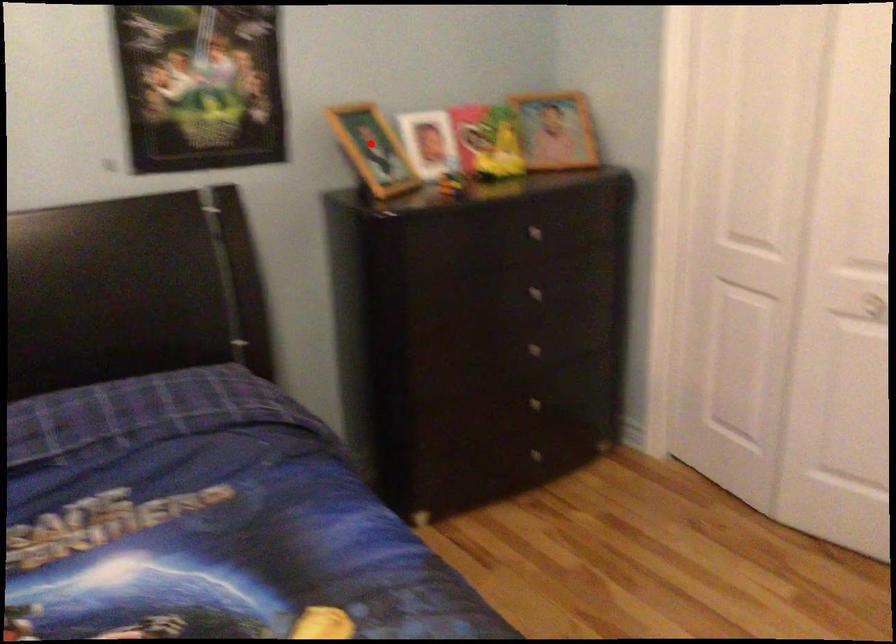
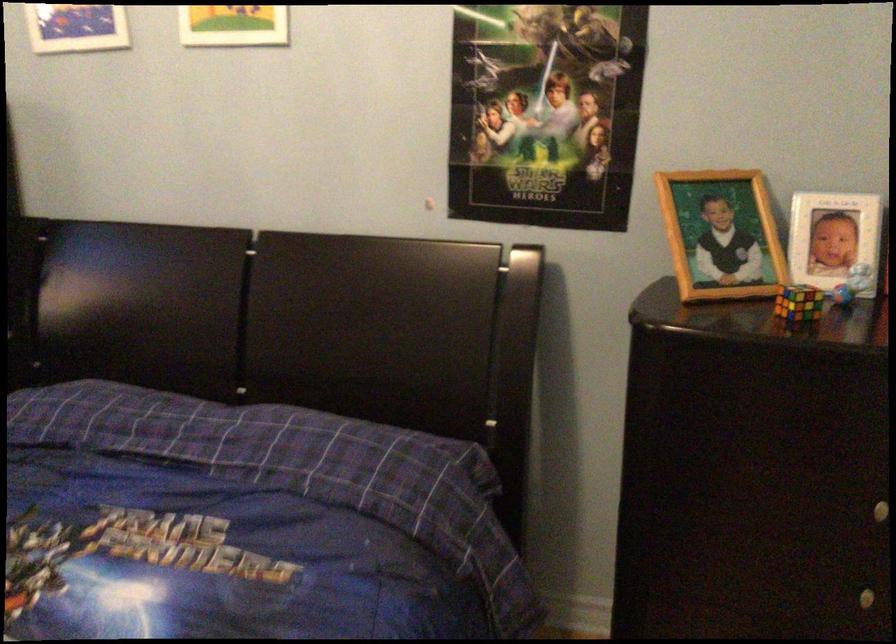
Locate, in the second image, the point that corresponds to the highlighted location in the first image.

(720, 234)